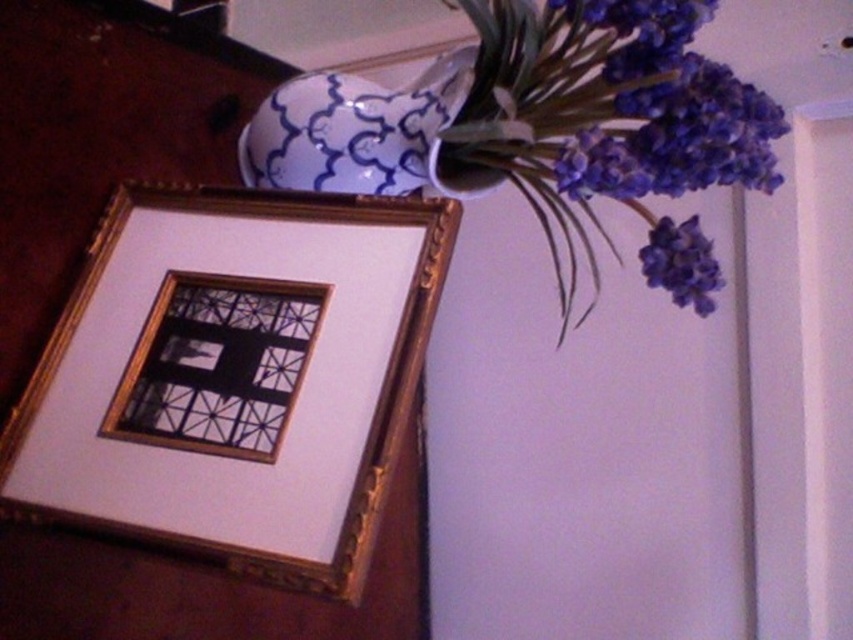
Question: Which object is positioned closest to the blue and white porcelain vase at upper right?

Choices:
 (A) blue glossy vase at upper right
 (B) purple matte flowers at upper right
 (C) gold/gilded picture frame at upper left
 (D) matte purple flower at upper right

Answer: (A)

Question: Which point is farther from the camera taking this photo?

Choices:
 (A) (666, 80)
 (B) (558, 189)

Answer: (B)

Question: Is gold/gilded picture frame at upper left wider than blue and white porcelain vase at upper right?

Choices:
 (A) no
 (B) yes

Answer: (B)

Question: Considering the real-world distances, which object is farthest from the matte purple flower at upper right?

Choices:
 (A) purple matte flowers at upper right
 (B) gold/gilded picture frame at upper left
 (C) blue glossy vase at upper right

Answer: (B)

Question: Is blue and white porcelain vase at upper right above matte purple flower at upper right?

Choices:
 (A) no
 (B) yes

Answer: (B)

Question: Can you confirm if gold/gilded picture frame at upper left is thinner than purple matte flowers at upper right?

Choices:
 (A) yes
 (B) no

Answer: (B)